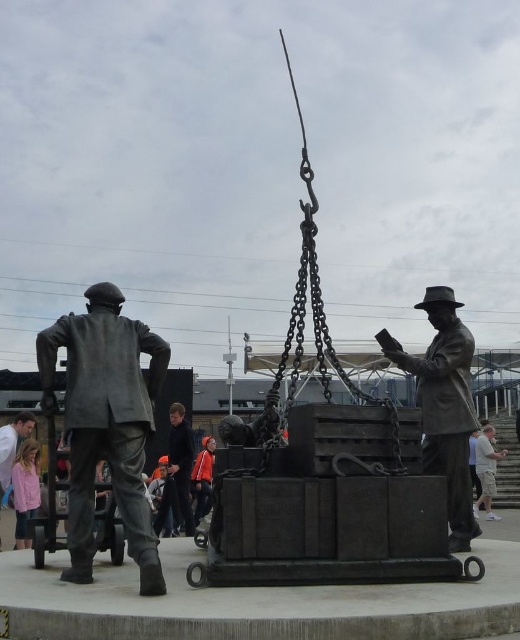
Question: Among these objects, which one is farthest from the camera?

Choices:
 (A) pink fabric at lower left
 (B) dark gray jacket at center
 (C) bronze statue at center

Answer: (B)

Question: Which point is farther to the camera?

Choices:
 (A) (387, 508)
 (B) (27, 538)
 (C) (47, 410)

Answer: (B)

Question: Can you confirm if bronze statue at right is smaller than orange jacket at center?

Choices:
 (A) yes
 (B) no

Answer: (B)

Question: Does bronze statue at left have a larger size compared to pink fabric at lower left?

Choices:
 (A) yes
 (B) no

Answer: (A)

Question: Is the position of bronze statue at left more distant than that of bronze statue at right?

Choices:
 (A) yes
 (B) no

Answer: (B)

Question: Which point appears closest to the camera in this image?

Choices:
 (A) (180, 496)
 (B) (351, 522)
 (C) (28, 497)
 (D) (197, 515)

Answer: (B)